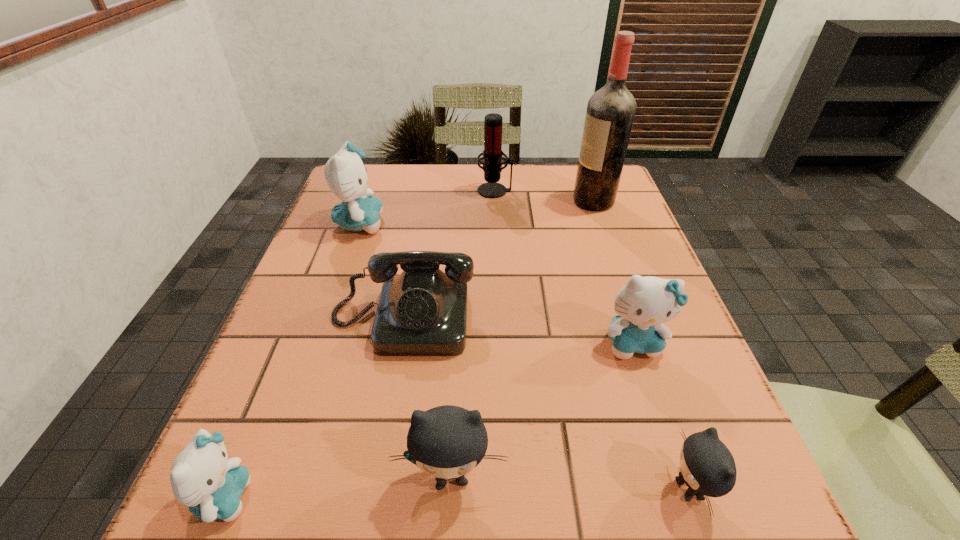
Select which blue kitten is the third closest to the smaller gray kitten. Please provide its 2D coordinates. Your answer should be formatted as a tuple, i.e. [(x, y)], where the tuple contains the x and y coordinates of a point satisfying the conditions above.

[(345, 174)]

You are a GUI agent. You are given a task and a screenshot of the screen. Output one action in this format:
    pyautogui.click(x=<x>, y=<y>)
    Task: Click on the blue kitten that is the closest to the left gray kitten
    
    Given the screenshot: What is the action you would take?
    pyautogui.click(x=202, y=477)

Identify the location of free space that satisfies the following two spatial constraints: 1. on the dial of the black telephone; 2. on the face of the smallest blue kitten. The height and width of the screenshot is (540, 960). (372, 497).

The width and height of the screenshot is (960, 540). I want to click on vacant region that satisfies the following two spatial constraints: 1. on the front-facing side of the bigger gray kitten; 2. on the face of the smallest blue kitten, so click(x=450, y=497).

Image resolution: width=960 pixels, height=540 pixels. In order to click on blank area in the image that satisfies the following two spatial constraints: 1. on the front-facing side of the tallest object; 2. on the face of the second nearest blue kitten in this screenshot , I will do `click(643, 343)`.